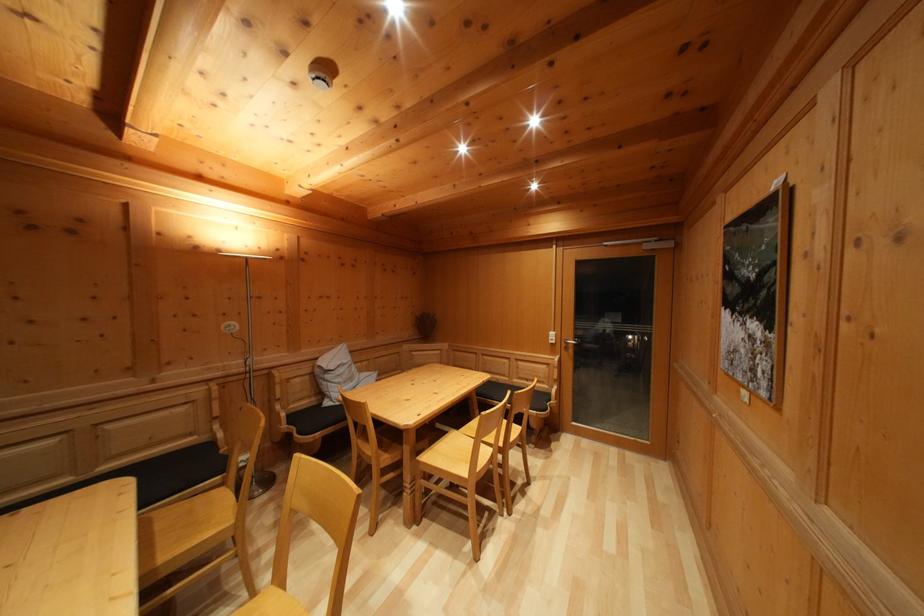
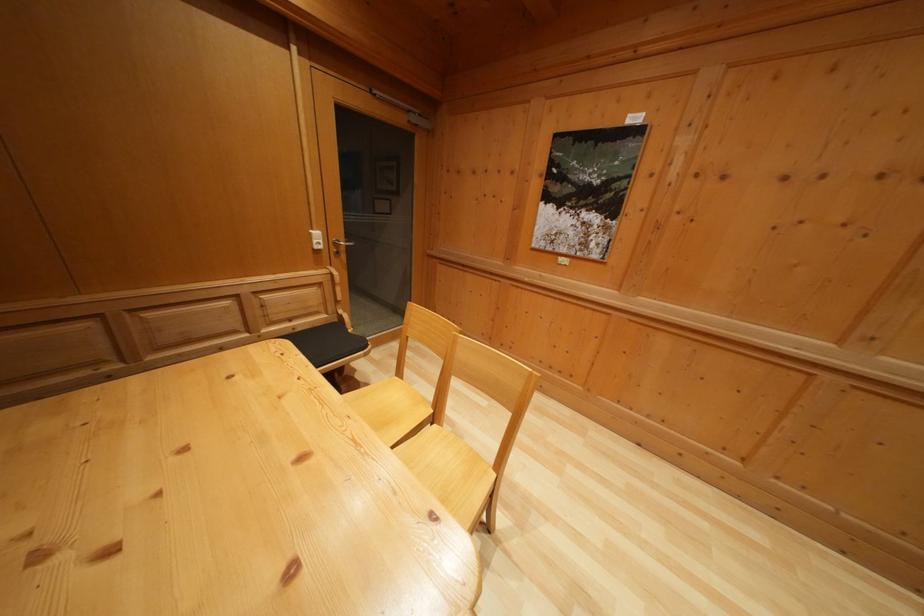
Find the pixel in the second image that matches point 558,341 in the first image.

(322, 240)